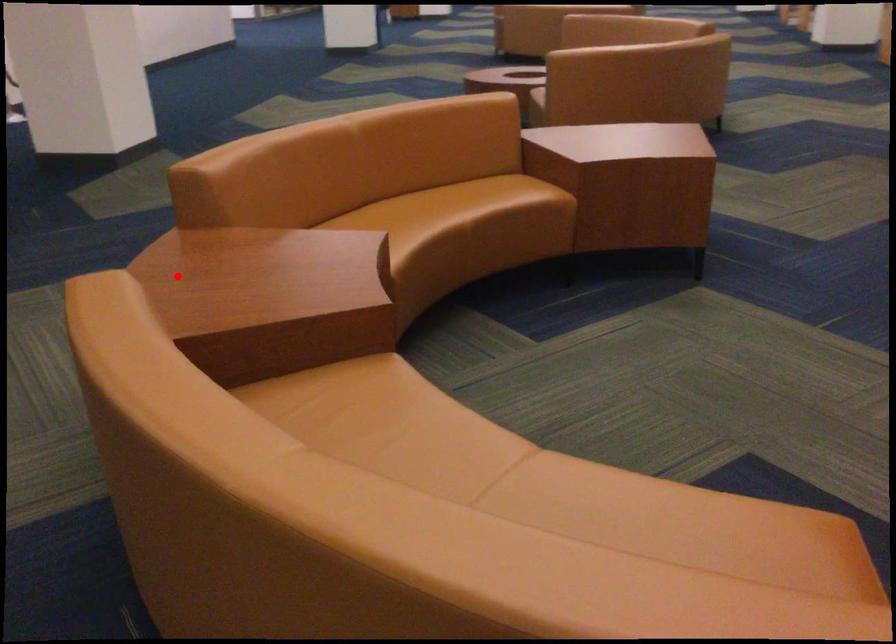
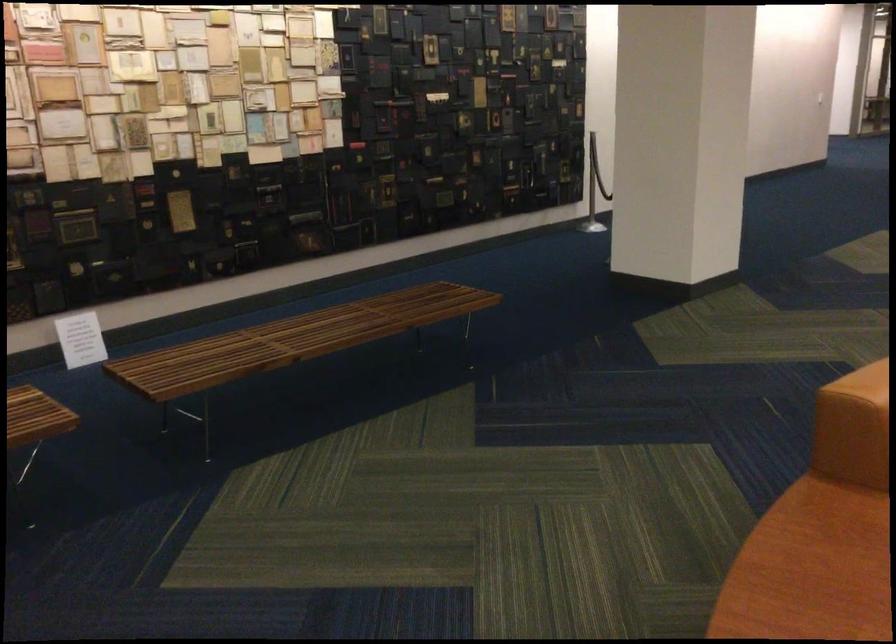
Locate, in the second image, the point that corresponds to the highlighted location in the first image.

(811, 569)